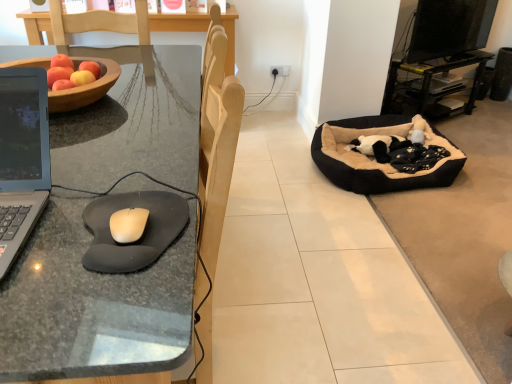
Locate an element on the screen. The width and height of the screenshot is (512, 384). free space to the left of black foam mousepad at left is located at coordinates (55, 225).